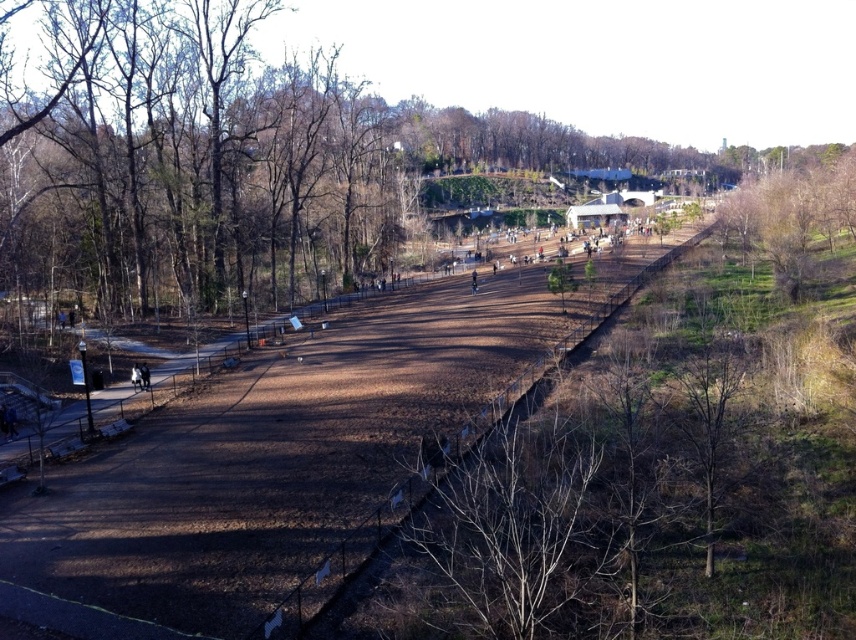
You are planning to take a photo of the park scene. You want to include both the bare wood trees at upper left and the brown dirt track at center in your shot. Which object should you focus on first if you want to ensure both are in frame without moving the camera?

The bare wood trees at upper left has a larger size compared to the brown dirt track at center, so you should focus on the bare wood trees at upper left first to ensure both are in frame without moving the camera.

You are planning to take a photo of the park scene. You want to include both the bare wood trees at upper left and the bare wood tree at right in your frame. Which tree group should you focus on to ensure both are in the shot without needing to adjust your camera angle?

The bare wood trees at upper left are larger in size compared to the bare wood tree at right, so focusing on them will help ensure both are captured in the frame without needing to adjust your camera angle.